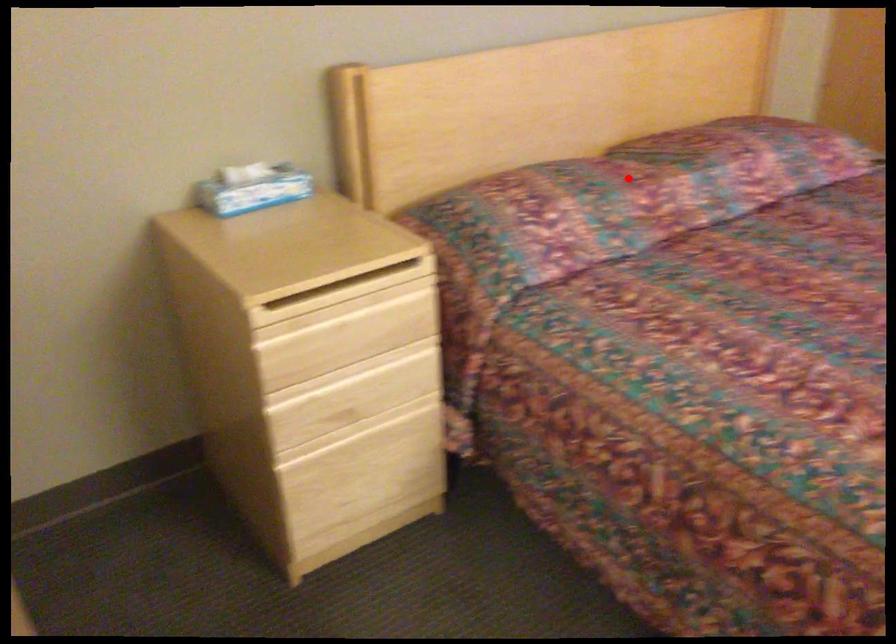
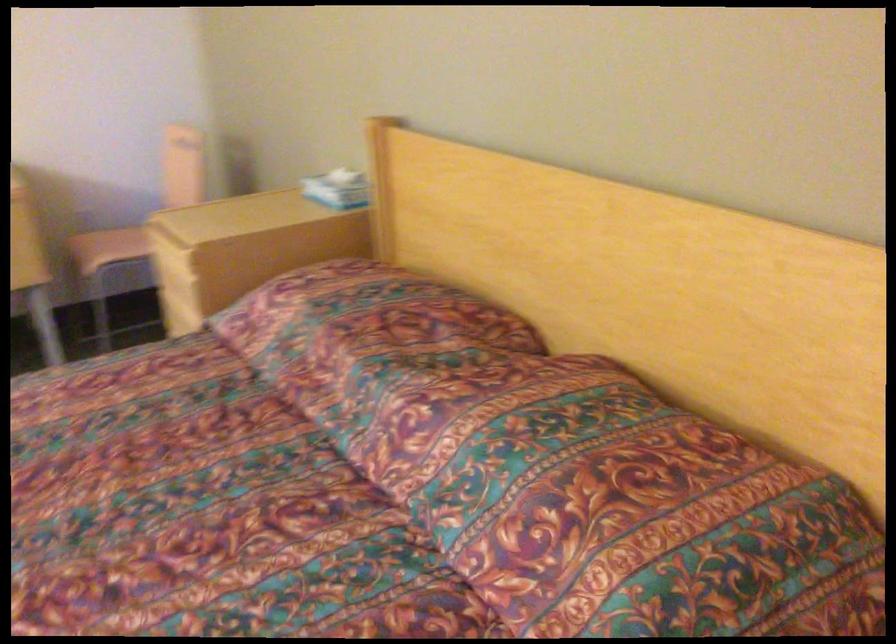
In the second image, find the point that corresponds to the highlighted location in the first image.

(354, 325)